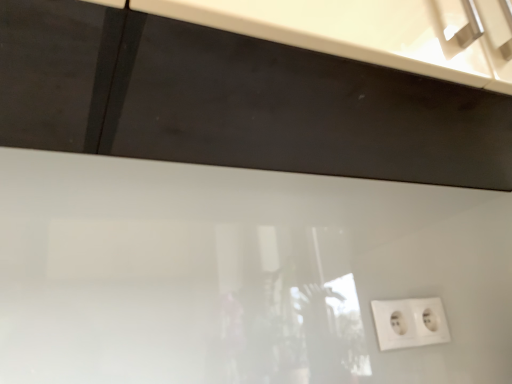
Measure the distance between point (x=202, y=50) and camera.

They are 17.32 inches apart.

The height and width of the screenshot is (384, 512). I want to click on white glossy cabinet at upper center, so click(234, 101).

This screenshot has width=512, height=384. What do you see at coordinates (234, 101) in the screenshot?
I see `white glossy cabinet at upper center` at bounding box center [234, 101].

In order to face white plastic power plugs and sockets at lower right, should I rotate leftwards or rightwards?

You should look right and rotate roughly 20.323 degrees.

What do you see at coordinates (409, 322) in the screenshot? This screenshot has width=512, height=384. I see `white plastic power plugs and sockets at lower right` at bounding box center [409, 322].

Identify the location of white plastic power plugs and sockets at lower right. coord(409,322).

Where is `white glossy cabinet at upper center`? This screenshot has height=384, width=512. white glossy cabinet at upper center is located at coordinates (234, 101).

Considering the relative positions of white glossy cabinet at upper center and white plastic power plugs and sockets at lower right in the image provided, is white glossy cabinet at upper center to the left of white plastic power plugs and sockets at lower right from the viewer's perspective?

Correct, you'll find white glossy cabinet at upper center to the left of white plastic power plugs and sockets at lower right.

Considering their positions, is white glossy cabinet at upper center located in front of or behind white plastic power plugs and sockets at lower right?

Visually, white glossy cabinet at upper center is located in front of white plastic power plugs and sockets at lower right.

Is point (69, 58) farther from viewer compared to point (443, 332)?

No, it is in front of (443, 332).

From the image's perspective, is white glossy cabinet at upper center above or below white plastic power plugs and sockets at lower right?

white glossy cabinet at upper center is above white plastic power plugs and sockets at lower right.

From a real-world perspective, which object rests below the other?

white plastic power plugs and sockets at lower right is physically lower.

Considering the sizes of objects white glossy cabinet at upper center and white plastic power plugs and sockets at lower right in the image provided, who is wider, white glossy cabinet at upper center or white plastic power plugs and sockets at lower right?

Wider between the two is white glossy cabinet at upper center.

Considering the relative sizes of white glossy cabinet at upper center and white plastic power plugs and sockets at lower right in the image provided, is white glossy cabinet at upper center taller than white plastic power plugs and sockets at lower right?

Correct, white glossy cabinet at upper center is much taller as white plastic power plugs and sockets at lower right.

Is white glossy cabinet at upper center bigger or smaller than white plastic power plugs and sockets at lower right?

Clearly, white glossy cabinet at upper center is larger in size than white plastic power plugs and sockets at lower right.

Do you think white glossy cabinet at upper center is within white plastic power plugs and sockets at lower right, or outside of it?

white glossy cabinet at upper center is located beyond the bounds of white plastic power plugs and sockets at lower right.

Is white glossy cabinet at upper center positioned far away from white plastic power plugs and sockets at lower right?

They are positioned close to each other.

Is white glossy cabinet at upper center facing away from white plastic power plugs and sockets at lower right?

No, white glossy cabinet at upper center's orientation is not away from white plastic power plugs and sockets at lower right.

Can you tell me how much white glossy cabinet at upper center and white plastic power plugs and sockets at lower right differ in facing direction?

0.948 degrees separate the facing orientations of white glossy cabinet at upper center and white plastic power plugs and sockets at lower right.

At what (x,y) coordinates should I click in order to perform the action: click on power plugs and sockets that is on the right side of white glossy cabinet at upper center. Please return your answer as a coordinate pair (x, y). The image size is (512, 384). Looking at the image, I should click on (409, 322).

Would you say white plastic power plugs and sockets at lower right is to the left or to the right of white glossy cabinet at upper center in the picture?

In the image, white plastic power plugs and sockets at lower right appears on the right side of white glossy cabinet at upper center.

Is white plastic power plugs and sockets at lower right in front of or behind white glossy cabinet at upper center in the image?

Visually, white plastic power plugs and sockets at lower right is located behind white glossy cabinet at upper center.

Does point (399, 309) lie behind point (494, 158)?

That is False.

From the image's perspective, is white plastic power plugs and sockets at lower right located beneath white glossy cabinet at upper center?

Indeed, from the image's perspective, white plastic power plugs and sockets at lower right is shown beneath white glossy cabinet at upper center.

From a real-world perspective, does white plastic power plugs and sockets at lower right stand above white glossy cabinet at upper center?

Incorrect, from a real-world perspective, white plastic power plugs and sockets at lower right is lower than white glossy cabinet at upper center.

Between white plastic power plugs and sockets at lower right and white glossy cabinet at upper center, which one has larger width?

white glossy cabinet at upper center.

From their relative heights in the image, would you say white plastic power plugs and sockets at lower right is taller or shorter than white glossy cabinet at upper center?

Considering their sizes, white plastic power plugs and sockets at lower right has less height than white glossy cabinet at upper center.

Which of these two, white plastic power plugs and sockets at lower right or white glossy cabinet at upper center, is bigger?

→ With larger size is white glossy cabinet at upper center.

Is white plastic power plugs and sockets at lower right spatially inside white glossy cabinet at upper center, or outside of it?

The correct answer is: outside.

Is white plastic power plugs and sockets at lower right touching white glossy cabinet at upper center?

white plastic power plugs and sockets at lower right and white glossy cabinet at upper center are clearly separated.

Is white plastic power plugs and sockets at lower right oriented towards white glossy cabinet at upper center?

No, white plastic power plugs and sockets at lower right is not turned towards white glossy cabinet at upper center.

Could you measure the distance between white plastic power plugs and sockets at lower right and white glossy cabinet at upper center?

15.47 inches.

You are a GUI agent. You are given a task and a screenshot of the screen. Output one action in this format:
    pyautogui.click(x=<x>, y=<y>)
    Task: Click on the power plugs and sockets behind the white glossy cabinet at upper center
    
    Given the screenshot: What is the action you would take?
    pyautogui.click(x=409, y=322)

I want to click on power plugs and sockets below the white glossy cabinet at upper center (from the image's perspective), so click(409, 322).

At what (x,y) coordinates should I click in order to perform the action: click on power plugs and sockets below the white glossy cabinet at upper center (from a real-world perspective). Please return your answer as a coordinate pair (x, y). Image resolution: width=512 pixels, height=384 pixels. Looking at the image, I should click on (409, 322).